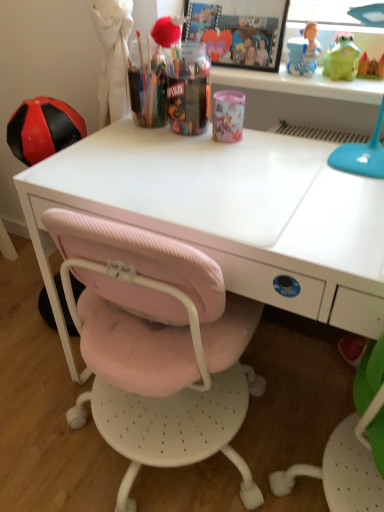
Find the location of a particular element. The height and width of the screenshot is (512, 384). vacant space situated above pink fabric chair at lower left (from a real-world perspective) is located at coordinates (81, 381).